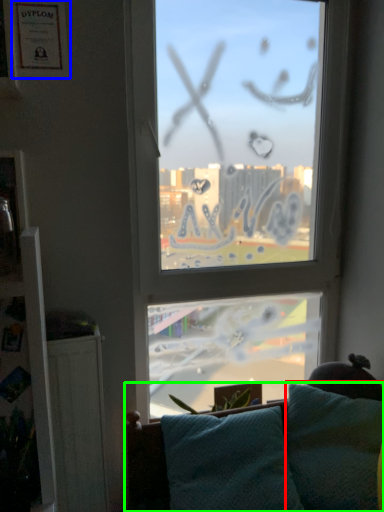
Question: Which object is positioned closest to pillow (highlighted by a red box)? Select from picture frame (highlighted by a blue box) and studio couch (highlighted by a green box).

Choices:
 (A) picture frame
 (B) studio couch

Answer: (B)